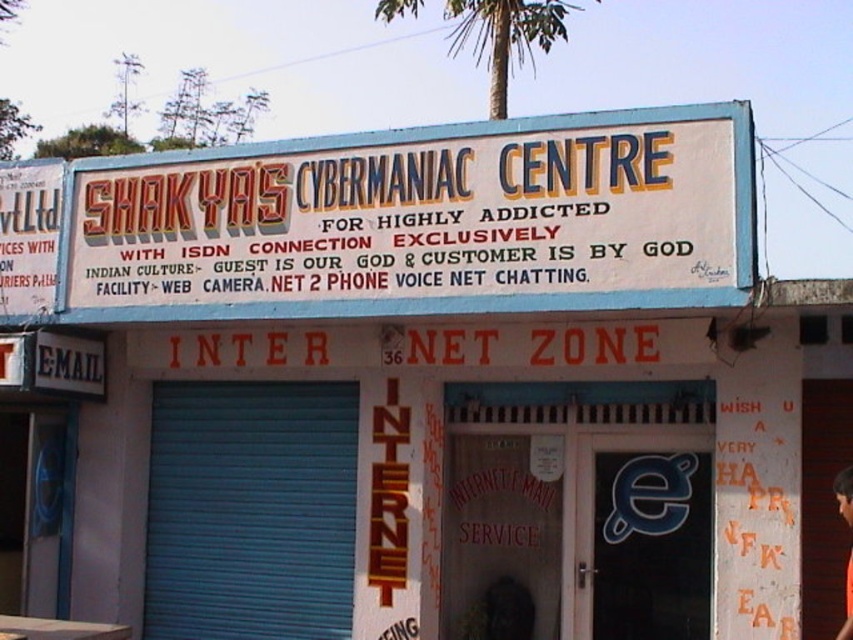
Question: Is white painted signboard at upper center thinner than orange fabric shirt at center?

Choices:
 (A) no
 (B) yes

Answer: (A)

Question: Which of these objects is positioned farthest from the orange fabric shirt at center?

Choices:
 (A) white painted signboard at upper center
 (B) green leafy palm tree at upper center

Answer: (B)

Question: Which object appears farthest from the camera in this image?

Choices:
 (A) orange fabric shirt at center
 (B) white painted signboard at upper center
 (C) green leafy palm tree at upper center

Answer: (C)

Question: Is white painted signboard at upper center positioned before green leafy palm tree at upper center?

Choices:
 (A) yes
 (B) no

Answer: (A)

Question: Is green leafy palm tree at upper center closer to camera compared to orange fabric shirt at center?

Choices:
 (A) no
 (B) yes

Answer: (A)

Question: Which object is closer to the camera taking this photo?

Choices:
 (A) orange fabric shirt at center
 (B) green leafy palm tree at upper center

Answer: (A)